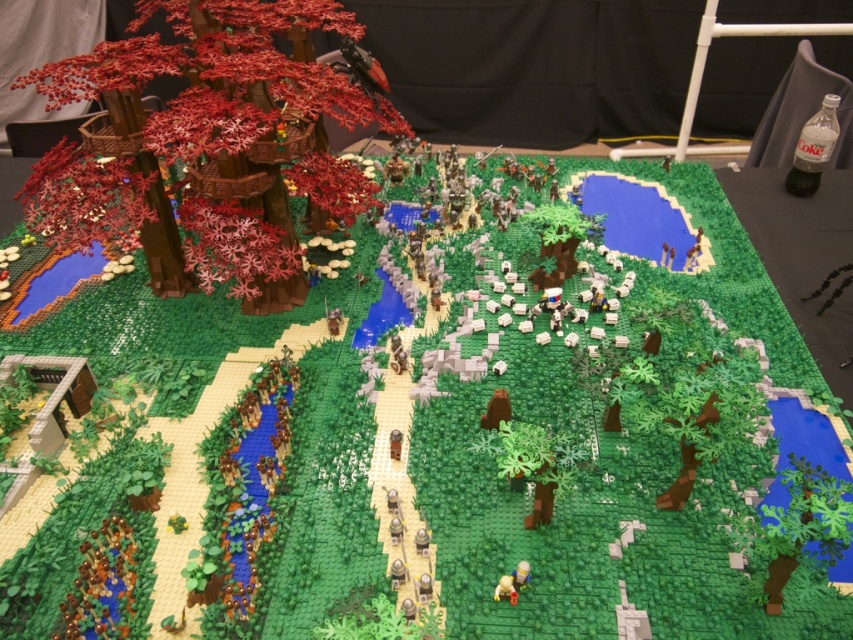
Between green matte tree at lower right and green matte tree at center, which one appears on the left side from the viewer's perspective?

Positioned to the left is green matte tree at center.

Describe the element at coordinates (798, 528) in the screenshot. I see `green matte tree at lower right` at that location.

At what (x,y) coordinates should I click in order to perform the action: click on green matte tree at lower right. Please return your answer as a coordinate pair (x, y). Looking at the image, I should click on (798, 528).

Is brick-red leaves at left closer to camera compared to green matte tree at center?

That is False.

Is brick-red leaves at left shorter than green matte tree at center?

No, brick-red leaves at left is not shorter than green matte tree at center.

Describe the element at coordinates (207, 134) in the screenshot. I see `brick-red leaves at left` at that location.

Locate an element on the screen. The width and height of the screenshot is (853, 640). brick-red leaves at left is located at coordinates (207, 134).

Does brick-red leaves at left have a larger size compared to green matte tree at lower right?

Yes.

Does point (173, 12) lie in front of point (831, 564)?

No, it is behind (831, 564).

Is point (271, 125) behind point (776, 566)?

That is True.

Find the location of `brick-red leaves at left`. brick-red leaves at left is located at coordinates (207, 134).